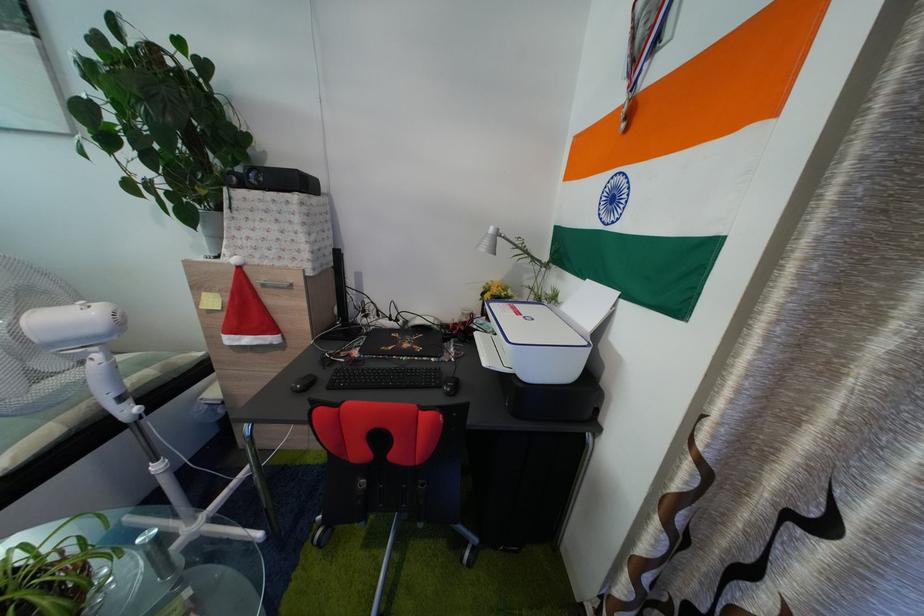
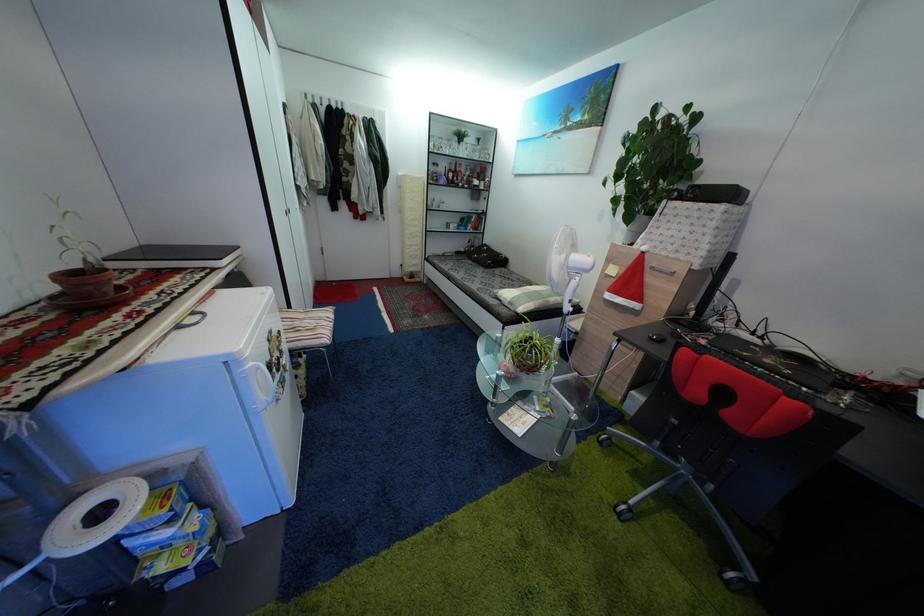
Where in the second image is the point corresponding to the point at 265,286 from the first image?

(659, 270)